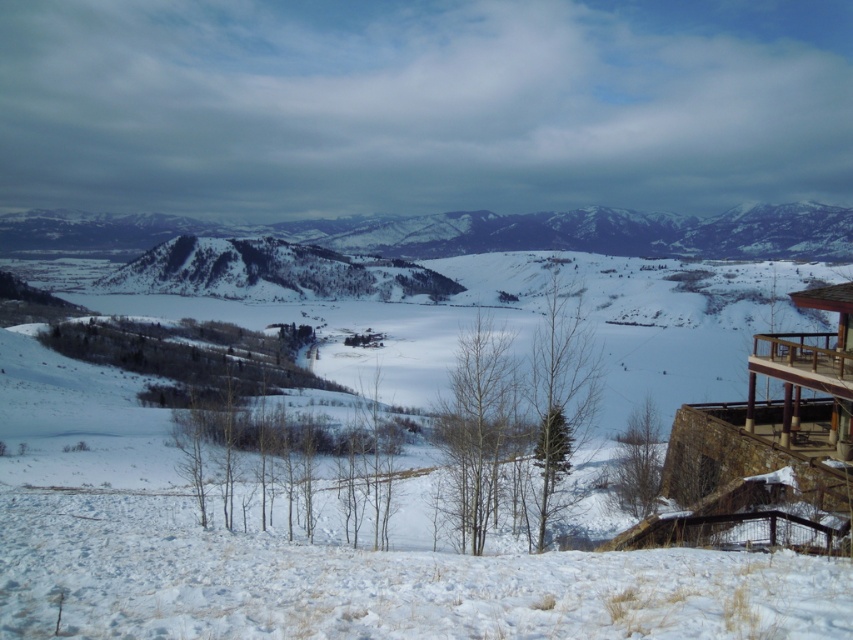
You are standing on the brown wooden balcony at lower right and want to look towards the snowy textured mountain at center. In which direction should you turn your head?

The snowy textured mountain at center is positioned on the left side of brown wooden balcony at lower right, so you should turn your head to the left to look towards the snowy textured mountain at center.

You are standing at the bottom of the hill in the foreground of the winter landscape. You see a point marked at coordinates [467,232]. What does this point represent in the scene?

The point at coordinates [467,232] corresponds to the snowy textured mountain at center.

You are standing at the base of the snow hill and see two points marked in the image. Which point is closer to you, point (x=366, y=237) or point (x=798, y=364)?

Point (x=366, y=237) is further to the camera than point (x=798, y=364), so the closer point to you is point (x=798, y=364).